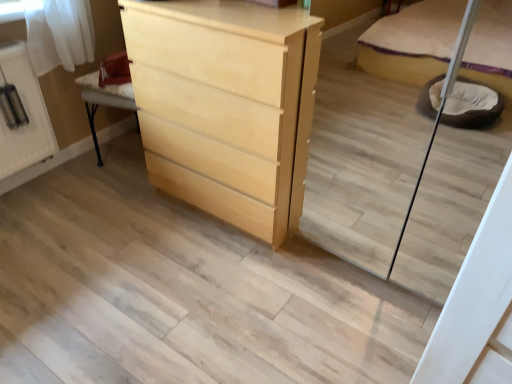
Question: From the image's perspective, is light wood/finish chest of drawers at center above or below white glossy cabinet at upper left?

Choices:
 (A) above
 (B) below

Answer: (B)

Question: In terms of size, does light wood/finish chest of drawers at center appear bigger or smaller than white glossy cabinet at upper left?

Choices:
 (A) small
 (B) big

Answer: (B)

Question: Is point (161, 41) closer or farther from the camera than point (34, 89)?

Choices:
 (A) closer
 (B) farther

Answer: (A)

Question: From a real-world perspective, is white glossy cabinet at upper left above or below light wood/finish chest of drawers at center?

Choices:
 (A) below
 (B) above

Answer: (A)

Question: Considering their positions, is white glossy cabinet at upper left located in front of or behind light wood/finish chest of drawers at center?

Choices:
 (A) front
 (B) behind

Answer: (B)

Question: Considering the positions of white glossy cabinet at upper left and light wood/finish chest of drawers at center in the image, is white glossy cabinet at upper left bigger or smaller than light wood/finish chest of drawers at center?

Choices:
 (A) big
 (B) small

Answer: (B)

Question: From the image's perspective, relative to light wood/finish chest of drawers at center, is white glossy cabinet at upper left above or below?

Choices:
 (A) above
 (B) below

Answer: (A)